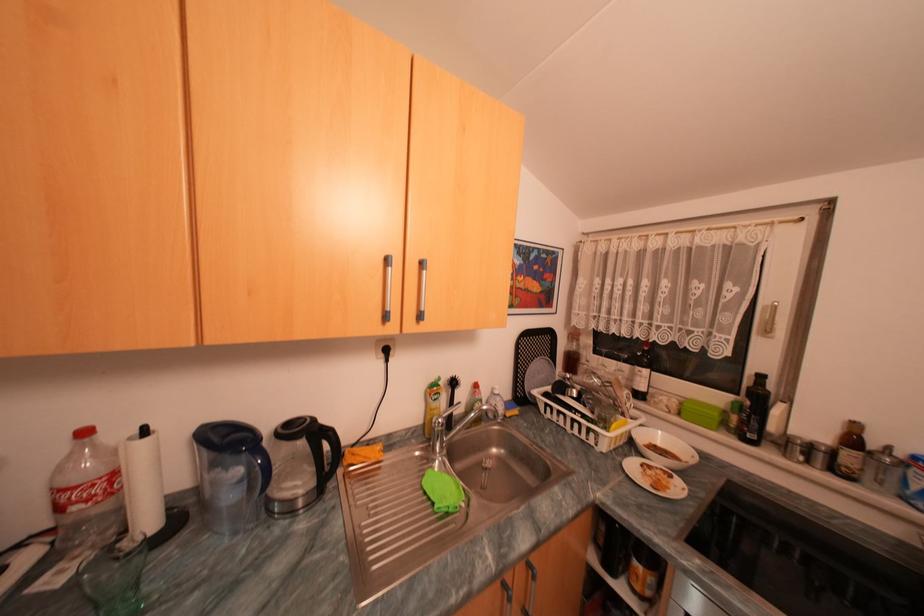
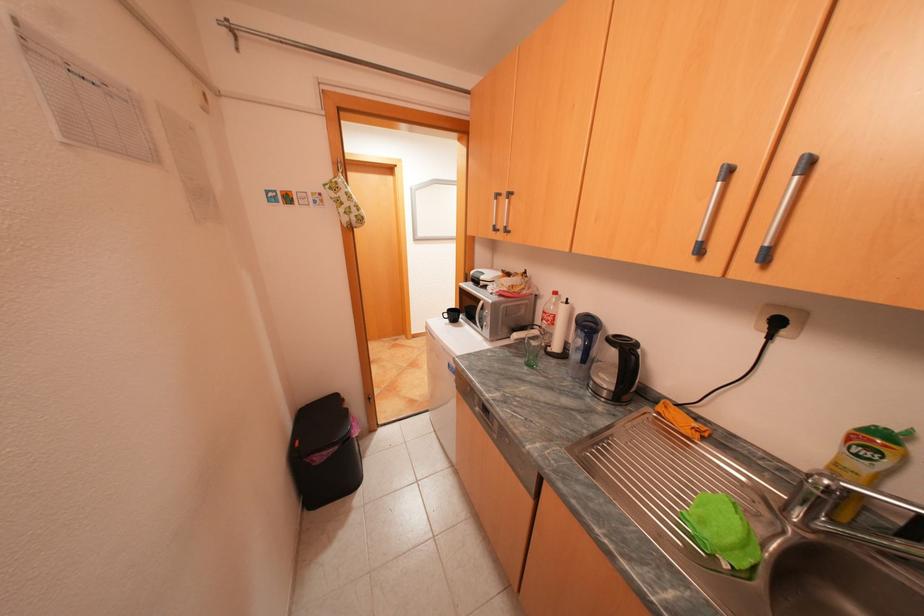
The point at [124,474] is marked in the first image. Where is the corresponding point in the second image?

(565, 315)